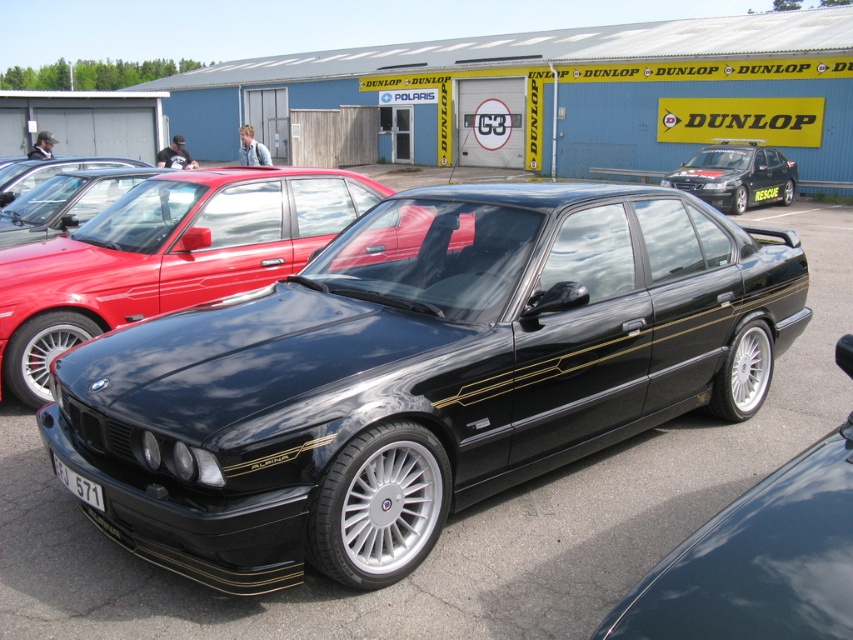
Question: Can you confirm if shiny black sedan at center is wider than white plastic license plate at center?

Choices:
 (A) yes
 (B) no

Answer: (A)

Question: Which point is farther to the camera?

Choices:
 (A) pyautogui.click(x=194, y=184)
 (B) pyautogui.click(x=772, y=193)

Answer: (B)

Question: Can you confirm if black metallic car at center is positioned below matte black car at upper left?

Choices:
 (A) yes
 (B) no

Answer: (A)

Question: Does glossy black car at center have a lesser width compared to black metallic car at center?

Choices:
 (A) yes
 (B) no

Answer: (B)

Question: Which point is farther to the camera?

Choices:
 (A) (119, 260)
 (B) (671, 176)

Answer: (B)

Question: Which object appears closest to the camera in this image?

Choices:
 (A) shiny black sedan at center
 (B) white plastic license plate at center

Answer: (A)